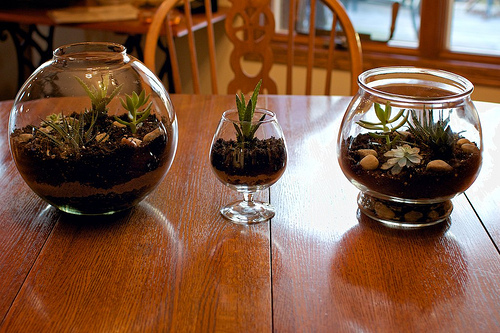
Where is `succulents in terrariums`? This screenshot has width=500, height=333. succulents in terrariums is located at coordinates (54, 135), (100, 91), (132, 108), (249, 115), (387, 115), (433, 121), (399, 158).